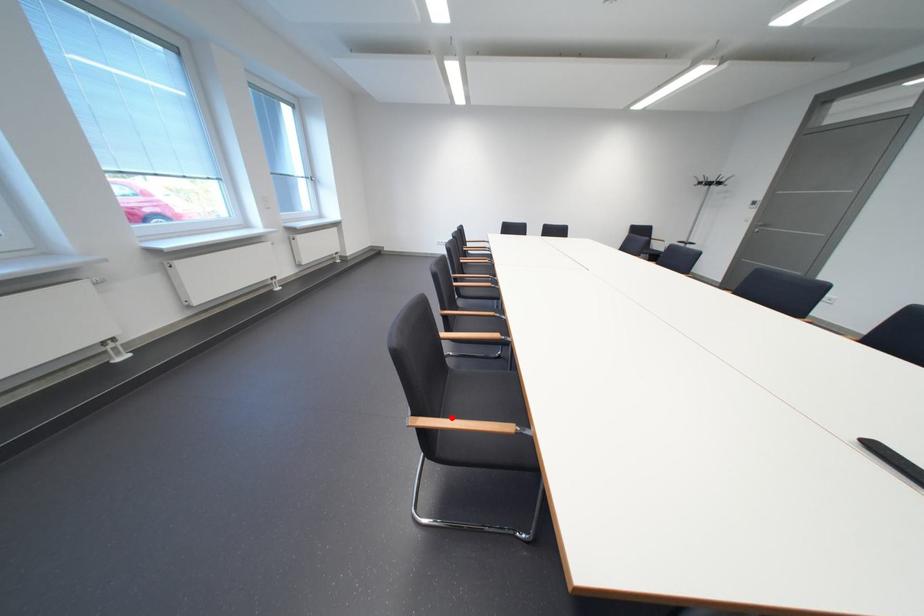
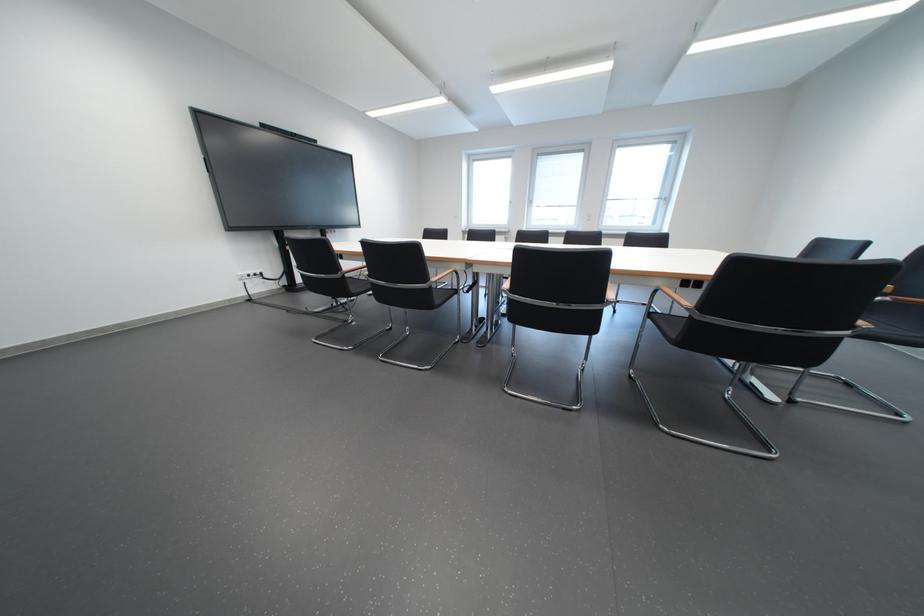
Question: I am providing you with two images of the same scene from different viewpoints. A red point is marked on the first image. Can you still see the location of the red point in image 2?

Choices:
 (A) Yes
 (B) No

Answer: (B)